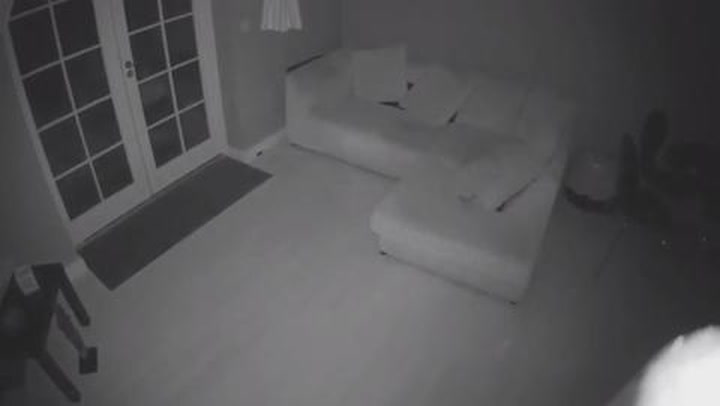
At what (x,y) coordinates should I click in order to perform the action: click on sofa pillow. Please return your answer as a coordinate pair (x, y). Looking at the image, I should click on (371, 74), (436, 95), (495, 113), (546, 115), (517, 185).